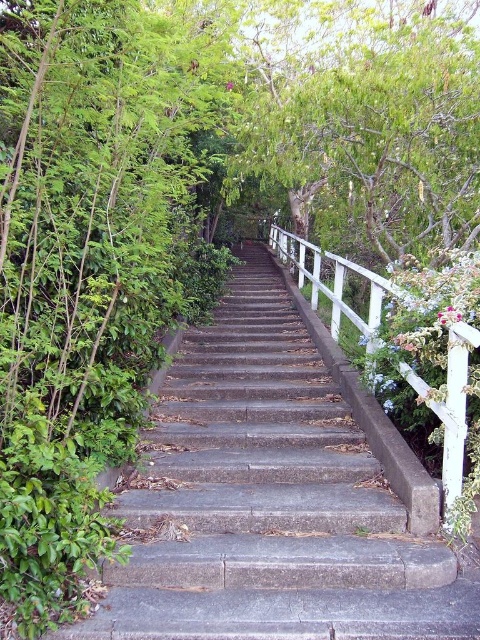
Who is lower down, gray concrete stairs at center or white wooden rail at right?

gray concrete stairs at center

Does point (203, 636) come farther from viewer compared to point (335, 296)?

No, it is in front of (335, 296).

Is point (277, 269) positioned in front of point (468, 344)?

No, (277, 269) is behind (468, 344).

The image size is (480, 640). What are the coordinates of `gray concrete stairs at center` in the screenshot? It's located at (276, 496).